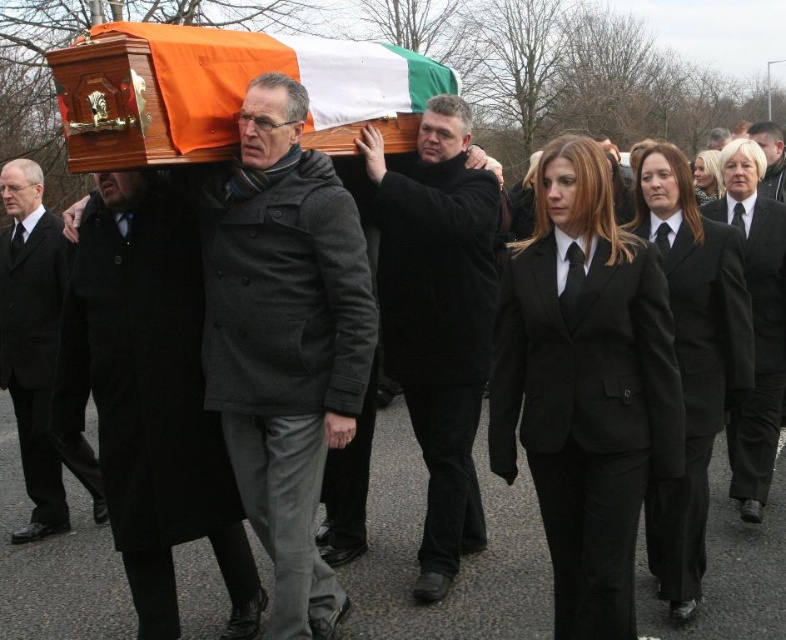
Question: Which of the following is the farthest from the observer?

Choices:
 (A) black matte coat at center
 (B) blonde hair at center
 (C) black wool suit at center
 (D) black satin suit at center

Answer: (A)

Question: In this image, where is black wool coat at center located relative to black matte coat at center?

Choices:
 (A) above
 (B) below

Answer: (B)

Question: Is dark gray wool coat at center in front of black wool suit at center?

Choices:
 (A) no
 (B) yes

Answer: (B)

Question: Which of these objects is positioned farthest from the black wool suit at left?

Choices:
 (A) dark gray wool coat at center
 (B) smooth black suit at center
 (C) blonde hair at center

Answer: (B)

Question: Does black wool suit at left appear on the left side of black wool business suit at right?

Choices:
 (A) yes
 (B) no

Answer: (A)

Question: Based on their relative distances, which object is nearer to the smooth black suit at center?

Choices:
 (A) black satin suit at center
 (B) black wool suit at left

Answer: (A)